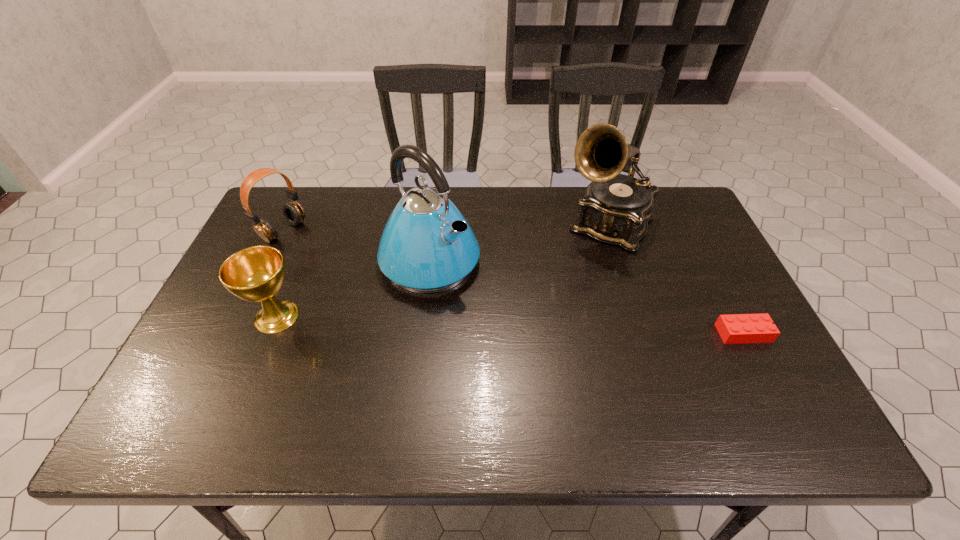
At what (x,y) coordinates should I click in order to perform the action: click on vacant region located 0.240m at the spout of the kettle. Please return your answer as a coordinate pair (x, y). The height and width of the screenshot is (540, 960). Looking at the image, I should click on (536, 336).

This screenshot has width=960, height=540. I want to click on vacant position located 0.100m on the ear cups of the headset, so click(x=319, y=253).

Identify the location of vacant space located 0.120m on the ear cups of the headset. (324, 256).

The width and height of the screenshot is (960, 540). Identify the location of vacant region located on the ear cups of the headset. (389, 295).

Find the location of a particular element. This screenshot has height=540, width=960. vacant space situated on the horn of the phonograph record is located at coordinates (542, 333).

This screenshot has width=960, height=540. Find the location of `free location located on the horn of the phonograph record`. free location located on the horn of the phonograph record is located at coordinates click(573, 279).

The width and height of the screenshot is (960, 540). I want to click on free space located on the horn of the phonograph record, so click(x=573, y=279).

Identify the location of kettle that is positioned at the far edge. (427, 246).

Find the location of a particular element. Image resolution: width=960 pixels, height=540 pixels. headset present at the far edge is located at coordinates (293, 212).

Find the location of a particular element. phonograph record present at the far edge is located at coordinates (616, 208).